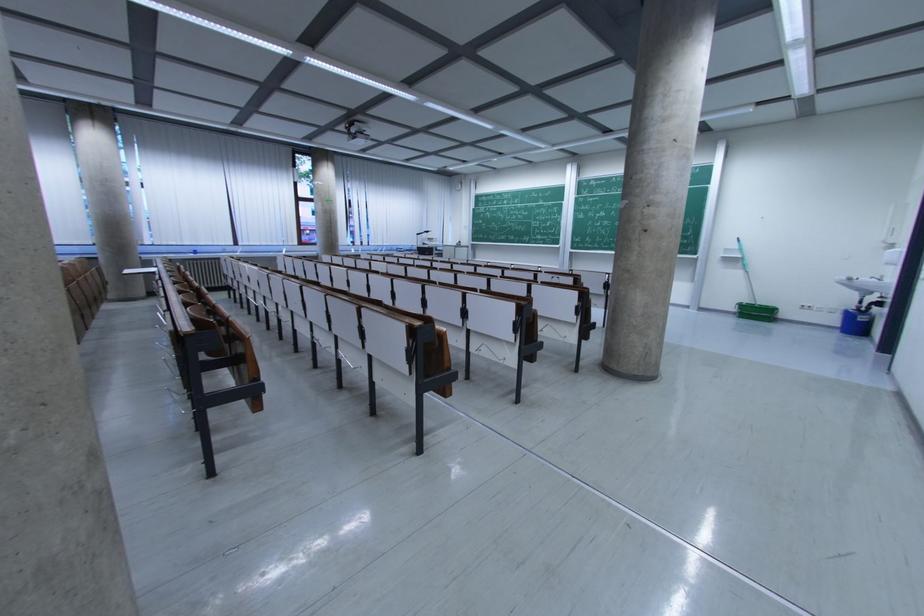
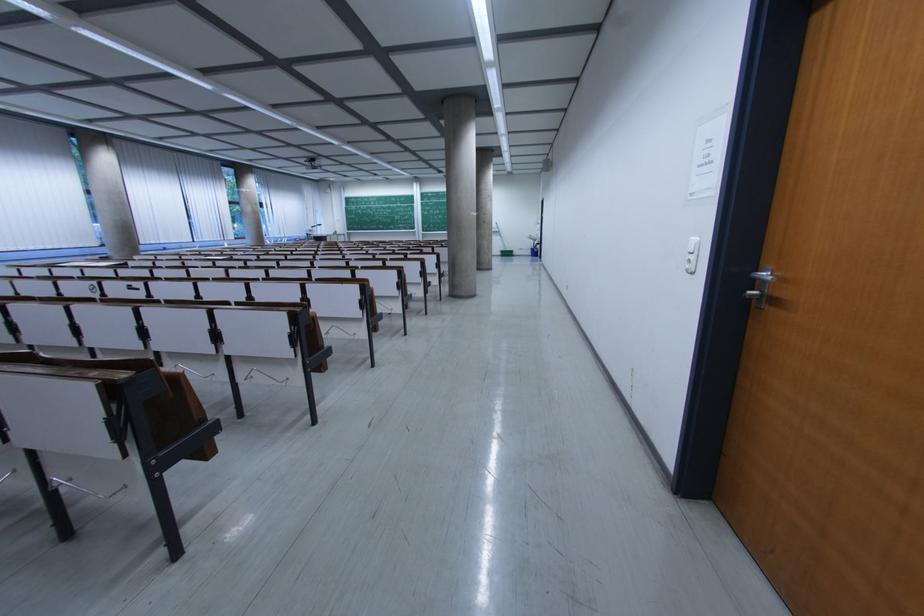
Where in the second image is the point corresponding to point (835, 315) from the first image?

(532, 253)